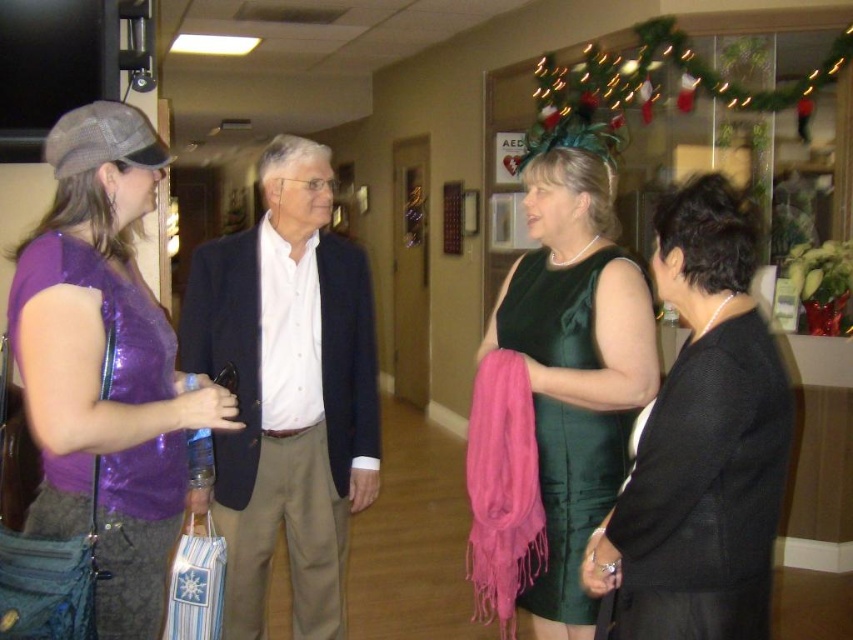
Based on the photo, measure the distance from white shirt at center to matte black dress at right.

white shirt at center is 3.36 feet from matte black dress at right.

Does white shirt at center appear on the right side of matte black dress at right?

Incorrect, white shirt at center is not on the right side of matte black dress at right.

Find the location of `white shirt at center`. white shirt at center is located at coordinates (288, 390).

From the picture: Can you confirm if white shirt at center is taller than green velvet dress at center?

Indeed, white shirt at center has a greater height compared to green velvet dress at center.

Is point (259, 253) positioned before point (541, 595)?

No, (259, 253) is behind (541, 595).

Is point (312, 259) less distant than point (578, 602)?

No, it is not.

At what (x,y) coordinates should I click in order to perform the action: click on white shirt at center. Please return your answer as a coordinate pair (x, y). This screenshot has height=640, width=853. Looking at the image, I should click on (288, 390).

Does point (355, 403) come in front of point (71, 488)?

No, it is not.

This screenshot has width=853, height=640. What do you see at coordinates (288, 390) in the screenshot? I see `white shirt at center` at bounding box center [288, 390].

Between point (251, 634) and point (82, 208), which one is positioned in front?

Point (82, 208) is in front.

Identify the location of white shirt at center. (288, 390).